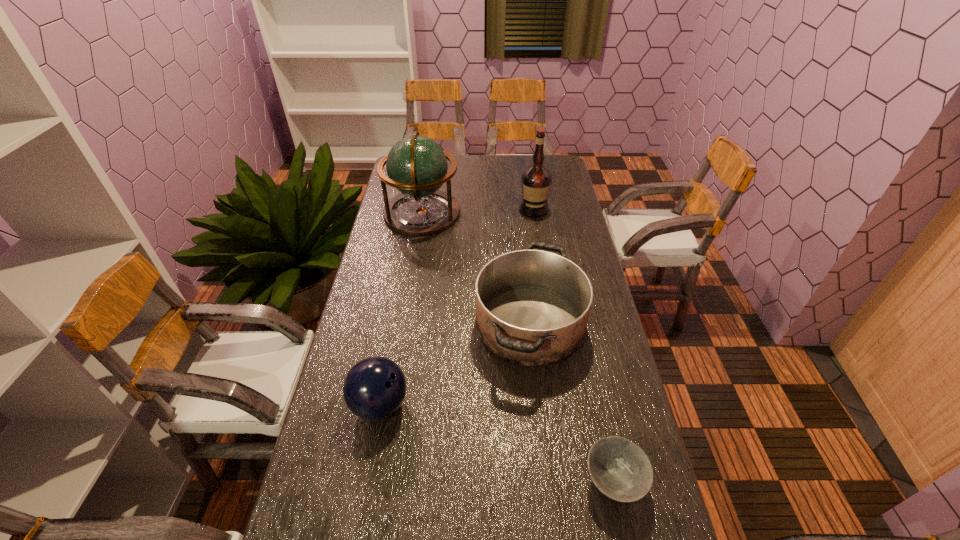
What are the coordinates of `vacant area situated 0.310m on the left of the shortest object` in the screenshot? It's located at (452, 481).

Where is `globe present at the left edge`? globe present at the left edge is located at coordinates (416, 165).

Where is `bowling ball that is at the left edge`? bowling ball that is at the left edge is located at coordinates (374, 388).

The width and height of the screenshot is (960, 540). Find the location of `liquor that is positioned at the right edge`. liquor that is positioned at the right edge is located at coordinates (536, 179).

Find the location of a particular element. Image resolution: width=960 pixels, height=540 pixels. saucepan present at the right edge is located at coordinates (532, 306).

I want to click on bowl that is positioned at the right edge, so pyautogui.click(x=620, y=469).

Identify the location of free location at the far edge of the desktop. The image size is (960, 540). (499, 167).

In the image, there is a desktop. Where is `vacant space at the left edge`? This screenshot has width=960, height=540. vacant space at the left edge is located at coordinates (389, 198).

Identify the location of vacant space at the right edge of the desktop. 608,320.

The image size is (960, 540). In the image, there is a desktop. In order to click on vacant space at the far right corner in this screenshot , I will do `click(546, 159)`.